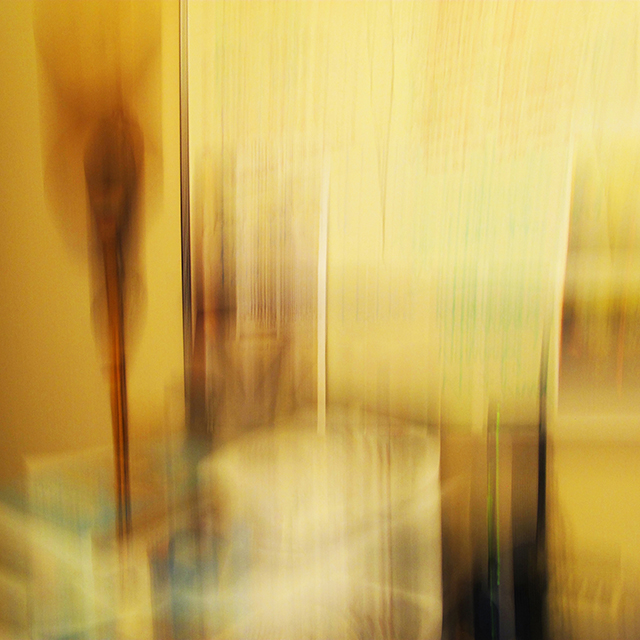
In order to click on wall in this screenshot , I will do `click(601, 128)`, `click(25, 406)`, `click(587, 435)`, `click(572, 68)`, `click(310, 104)`.